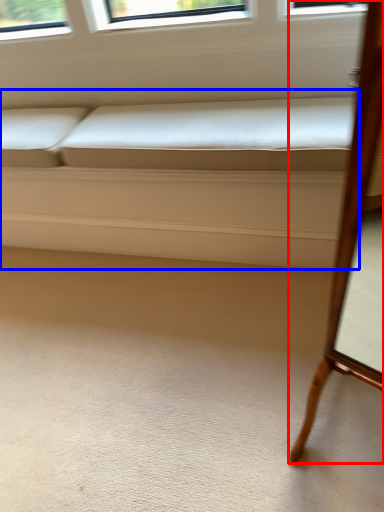
Question: Which point is closer to the camera, furniture (highlighted by a red box) or couch (highlighted by a blue box)?

Choices:
 (A) furniture
 (B) couch

Answer: (A)